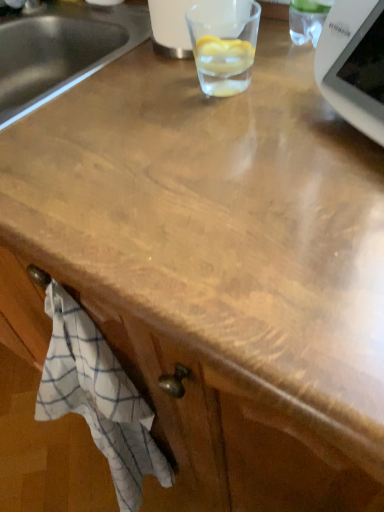
I want to click on white checkered cloth at lower left, so click(98, 398).

This screenshot has height=512, width=384. Describe the element at coordinates (98, 398) in the screenshot. I see `white checkered cloth at lower left` at that location.

You are a GUI agent. You are given a task and a screenshot of the screen. Output one action in this format:
    pyautogui.click(x=<x>, y=<y>)
    Task: Click on the white checkered cloth at lower left
    
    Given the screenshot: What is the action you would take?
    pyautogui.click(x=98, y=398)